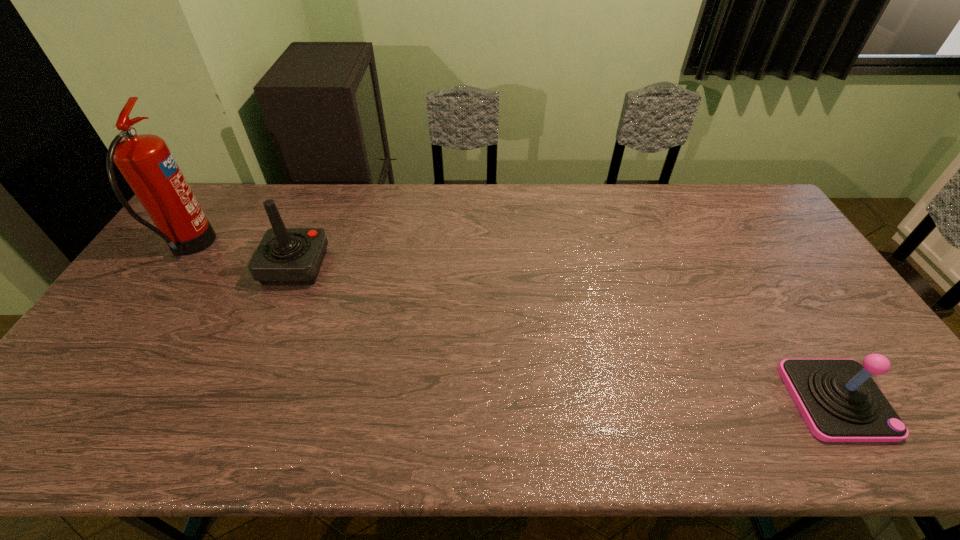
Locate an element on the screen. The image size is (960, 540). object positioned at the left edge is located at coordinates (145, 161).

Where is `object at the right edge`? Image resolution: width=960 pixels, height=540 pixels. object at the right edge is located at coordinates (x=839, y=401).

You are a GUI agent. You are given a task and a screenshot of the screen. Output one action in this format:
    pyautogui.click(x=<x>, y=<y>)
    Task: Click on the object present at the far left corner
    The width and height of the screenshot is (960, 540).
    Given the screenshot: What is the action you would take?
    pyautogui.click(x=145, y=161)

Image resolution: width=960 pixels, height=540 pixels. Find the location of `object situated at the near right corner`. object situated at the near right corner is located at coordinates (839, 401).

Where is `vacant point at the far edge`? vacant point at the far edge is located at coordinates (492, 187).

You are a GUI agent. You are given a task and a screenshot of the screen. Output one action in this format:
    pyautogui.click(x=<x>, y=<y>)
    Task: Click on the vacant area at the near edge of the desktop
    
    Given the screenshot: What is the action you would take?
    pyautogui.click(x=294, y=437)

The height and width of the screenshot is (540, 960). Identify the location of free space at the right edge of the desktop. (800, 318).

At what (x,y) coordinates should I click in order to perform the action: click on free region at the far right corner of the desktop. Please return your answer as a coordinate pair (x, y). Looking at the image, I should click on [711, 191].

I want to click on free space between the second tallest object and the shorter joystick, so click(x=565, y=333).

Locate an element on the screen. This screenshot has width=960, height=540. blank region between the farther joystick and the leftmost object is located at coordinates (242, 257).